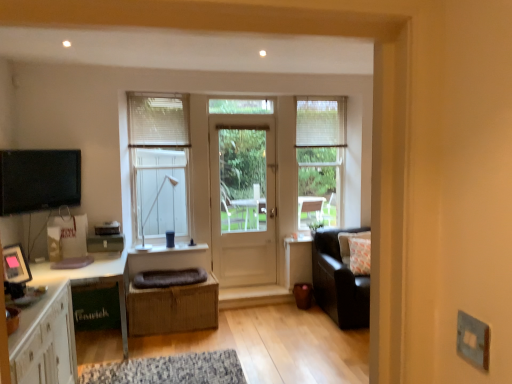
Identify the location of free space above brown woven crate at center (from a real-world perspective). This screenshot has width=512, height=384. (174, 282).